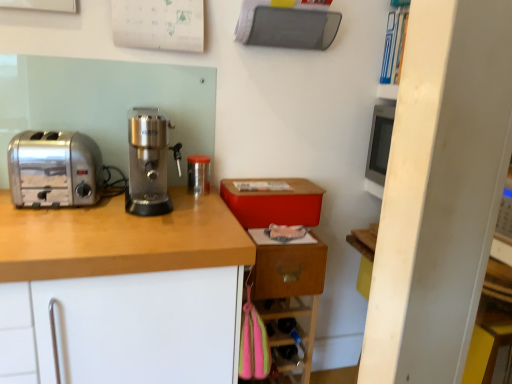
Question: Considering the relative positions of transparent plastic container at center and wooden at left in the image provided, is transparent plastic container at center to the right of wooden at left from the viewer's perspective?

Choices:
 (A) yes
 (B) no

Answer: (A)

Question: From the image's perspective, is transparent plastic container at center under wooden at left?

Choices:
 (A) yes
 (B) no

Answer: (B)

Question: From a real-world perspective, is transparent plastic container at center on top of wooden at left?

Choices:
 (A) no
 (B) yes

Answer: (B)

Question: Is transparent plastic container at center directly adjacent to wooden at left?

Choices:
 (A) yes
 (B) no

Answer: (B)

Question: From the image's perspective, does transparent plastic container at center appear higher than wooden at left?

Choices:
 (A) yes
 (B) no

Answer: (A)

Question: Is transparent plastic container at center not near wooden at left?

Choices:
 (A) yes
 (B) no

Answer: (B)

Question: Can you confirm if satin silver coffee grinder at center is smaller than wooden at left?

Choices:
 (A) yes
 (B) no

Answer: (A)

Question: Does satin silver coffee grinder at center have a greater height compared to wooden at left?

Choices:
 (A) no
 (B) yes

Answer: (A)

Question: From a real-world perspective, is satin silver coffee grinder at center located beneath wooden at left?

Choices:
 (A) no
 (B) yes

Answer: (A)

Question: From the image's perspective, would you say satin silver coffee grinder at center is positioned over wooden at left?

Choices:
 (A) no
 (B) yes

Answer: (B)

Question: From a real-world perspective, is satin silver coffee grinder at center on top of wooden at left?

Choices:
 (A) yes
 (B) no

Answer: (A)

Question: Can you confirm if satin silver coffee grinder at center is thinner than wooden at left?

Choices:
 (A) yes
 (B) no

Answer: (A)

Question: Is satin silver coffee grinder at center not within wooden drawer at lower right?

Choices:
 (A) no
 (B) yes

Answer: (B)